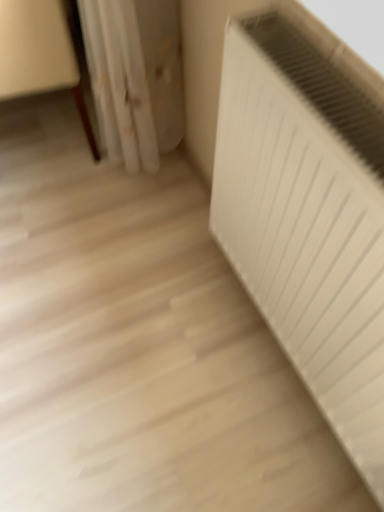
I want to click on vacant area situated below white matte radiator at right (from a real-world perspective), so click(x=275, y=354).